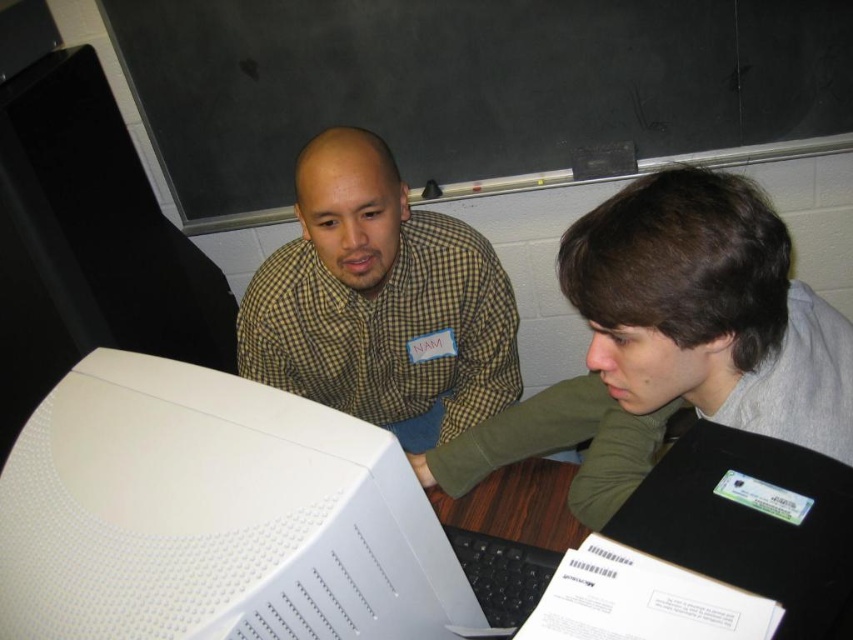
Between white textured monitor at lower left and gray-green fabric shirt at upper center, which one has more height?

gray-green fabric shirt at upper center is taller.

Is white textured monitor at lower left above gray-green fabric shirt at upper center?

Actually, white textured monitor at lower left is below gray-green fabric shirt at upper center.

Which is in front, point (318, 465) or point (810, 442)?

Point (318, 465) is in front.

The height and width of the screenshot is (640, 853). In order to click on white textured monitor at lower left in this screenshot , I will do `click(213, 516)`.

Can you confirm if blackboard at upper center is bigger than white textured monitor at lower left?

Indeed, blackboard at upper center has a larger size compared to white textured monitor at lower left.

The height and width of the screenshot is (640, 853). Describe the element at coordinates (469, 83) in the screenshot. I see `blackboard at upper center` at that location.

The image size is (853, 640). Identify the location of blackboard at upper center. (469, 83).

Does blackboard at upper center have a lesser width compared to checkered fabric shirt at upper center?

In fact, blackboard at upper center might be wider than checkered fabric shirt at upper center.

Between point (662, 150) and point (466, 316), which one is positioned in front?

Point (466, 316) is in front.

Measure the distance between blackboard at upper center and camera.

blackboard at upper center is 1.49 meters from camera.

Locate an element on the screen. blackboard at upper center is located at coordinates (469, 83).